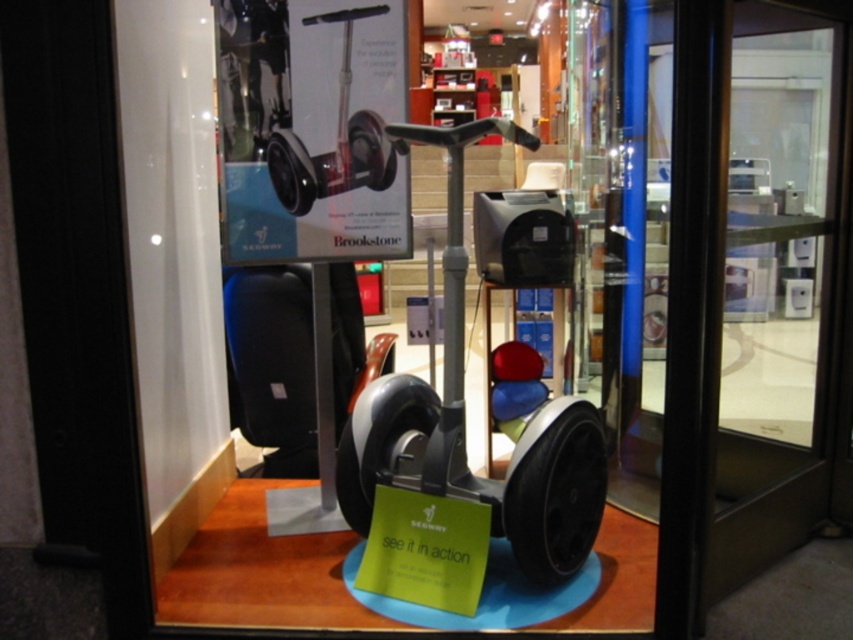
Question: Can you confirm if matte gray scooter at center is thinner than silver metallic segway at center?

Choices:
 (A) no
 (B) yes

Answer: (A)

Question: Can you confirm if matte gray scooter at center is positioned below silver metallic segway at center?

Choices:
 (A) no
 (B) yes

Answer: (B)

Question: Which point is closer to the camera taking this photo?

Choices:
 (A) (386, 150)
 (B) (465, 456)

Answer: (B)

Question: Which point is closer to the camera?

Choices:
 (A) (546, 554)
 (B) (181, 60)

Answer: (A)

Question: Is metallic gray hoverboard at center smaller than silver metallic segway at center?

Choices:
 (A) no
 (B) yes

Answer: (A)

Question: Which of the following is the closest to the observer?

Choices:
 (A) silver metallic segway at center
 (B) metallic gray hoverboard at center

Answer: (B)